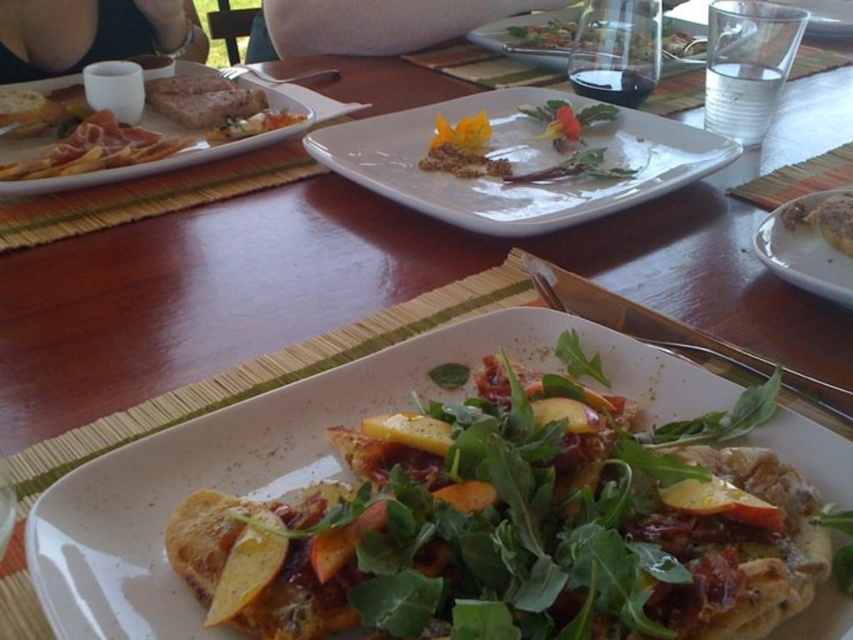
You are a waiter holding a dessert tray that is 8 inches wide. You need to place it on the table without moving any existing dishes. Can you fit the dessert tray between the matte white plate at center and the edge of the table?

The matte white plate at center is only 9.07 inches away from the camera, so there is enough space to place the dessert tray which is 8 inches wide between the matte white plate at center and the edge of the table.

You are a server at the outdoor restaurant and need to deliver a drink to the table. The drink must be placed on the white glossy plate at center. However, you have a 12 inch long tray. Can you safely place the drink on the plate without spilling it?

The white glossy plate at center is 19.16 inches away from the viewer. Since the tray is 12 inches long, the server can extend their arm to reach the plate and place the drink safely without spilling.

You are a server at the outdoor restaurant and need to clear the table. Which object, the white glossy plate at center or the matte brown crumb at center, is taller and should be handled with care to avoid spillage?

The white glossy plate at center is taller than the matte brown crumb at center, so it should be handled with care to avoid spillage.